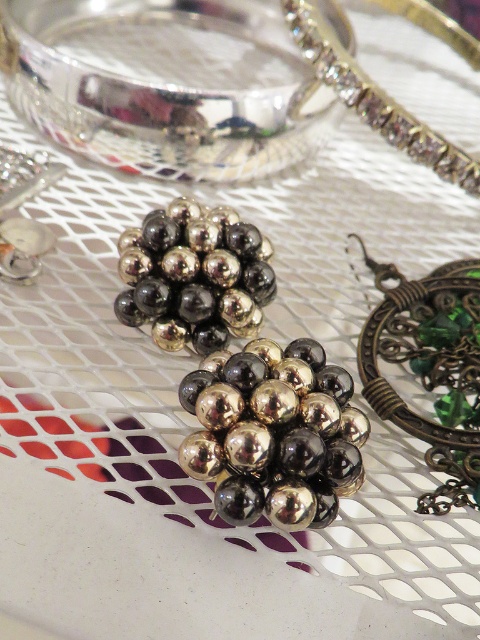
Does green glass pendant at upper right appear on the left side of shiny silver bracelet at upper right?

In fact, green glass pendant at upper right is to the right of shiny silver bracelet at upper right.

Between point (444, 460) and point (452, 180), which one is positioned behind?

The point (452, 180) is behind.

Who is more forward, (432,323) or (343,49)?

Point (432,323)

The width and height of the screenshot is (480, 640). What are the coordinates of `green glass pendant at upper right` in the screenshot? It's located at (430, 368).

Which is more to the right, green glass pendant at upper right or metallic gold/black beads at center?

green glass pendant at upper right

Between point (439, 378) and point (181, 278), which one is positioned behind?

Positioned behind is point (439, 378).

At what (x,y) coordinates should I click in order to perform the action: click on green glass pendant at upper right. Please return your answer as a coordinate pair (x, y). Looking at the image, I should click on (430, 368).

Which is above, metallic gold/black beads at center or shiny silver bracelet at upper right?

shiny silver bracelet at upper right is above.

Which is behind, point (173, 317) or point (404, 13)?

The point (404, 13) is behind.

Is point (226, 310) behind point (311, 8)?

No, it is not.

I want to click on metallic gold/black beads at center, so click(x=194, y=276).